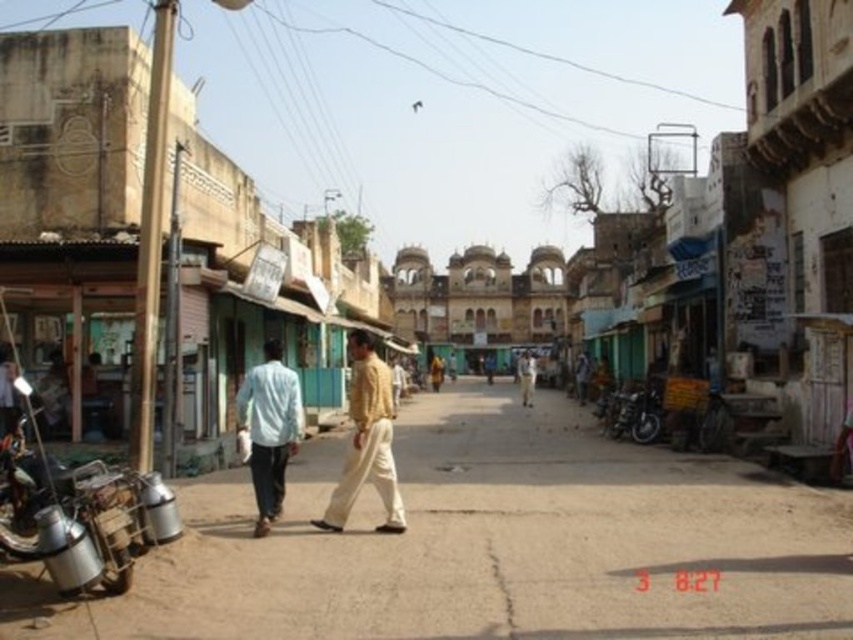
Does metallic silver motorcycle at left have a smaller size compared to light brown cotton shirt at center?

Yes.

Who is more forward, (65,524) or (525,401)?

Positioned in front is point (65,524).

I want to click on metallic silver motorcycle at left, so click(79, 515).

Which is in front, point (630, 416) or point (525, 404)?

Point (630, 416) is in front.

Based on the photo, which is below, shiny metallic motorcycle at center-right or light brown cotton shirt at center?

shiny metallic motorcycle at center-right

Where is `shiny metallic motorcycle at center-right`? shiny metallic motorcycle at center-right is located at coordinates (633, 412).

Can you confirm if smooth concrete alley at center is thinner than light brown cotton shirt at center?

No.

Who is more forward, (822, 602) or (525, 378)?

Point (822, 602) is more forward.

Is point (757, 512) positioned behind point (529, 380)?

No, (757, 512) is in front of (529, 380).

Locate an element on the screen. smooth concrete alley at center is located at coordinates (503, 541).